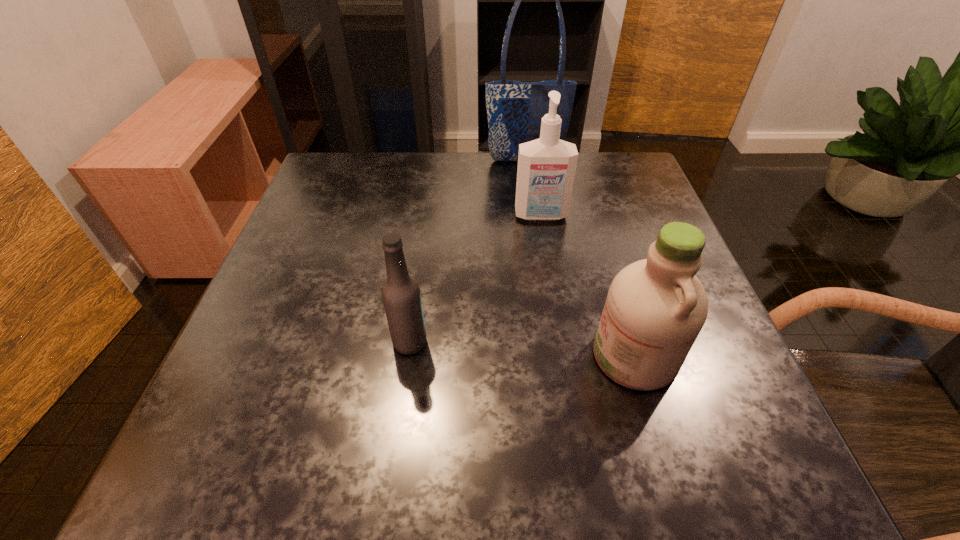
Where is `the farthest object`? The width and height of the screenshot is (960, 540). the farthest object is located at coordinates tap(515, 109).

You are a GUI agent. You are given a task and a screenshot of the screen. Output one action in this format:
    pyautogui.click(x=<x>, y=<y>)
    Task: Click on the shopping bag
    
    Given the screenshot: What is the action you would take?
    pyautogui.click(x=515, y=109)

The image size is (960, 540). Identify the location of the third nearest object. (546, 169).

At what (x,y) coordinates should I click in order to perform the action: click on the nearer cleansing agent. Please return your answer as a coordinate pair (x, y). This screenshot has width=960, height=540. Looking at the image, I should click on (656, 307).

Identify the location of beer bottle. This screenshot has height=540, width=960. (401, 295).

The height and width of the screenshot is (540, 960). I want to click on free space located on the front-facing side of the tallest object, so click(x=534, y=226).

The height and width of the screenshot is (540, 960). I want to click on vacant space situated on the front label of the second farthest object, so click(564, 364).

Identify the location of vacant space positioned 0.100m on the front label of the nearer cleansing agent. The height and width of the screenshot is (540, 960). (532, 355).

Identify the location of vacant area situated 0.120m on the front label of the nearer cleansing agent. point(519,355).

This screenshot has width=960, height=540. I want to click on vacant space situated 0.090m on the front label of the nearer cleansing agent, so click(x=538, y=355).